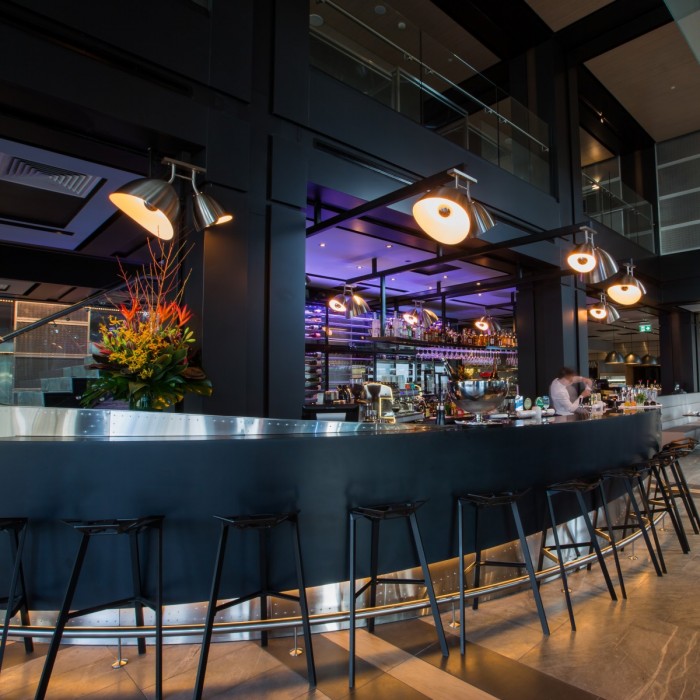
Find the location of a particular element. The height and width of the screenshot is (700, 700). shelf for alcohol storage is located at coordinates (474, 337).